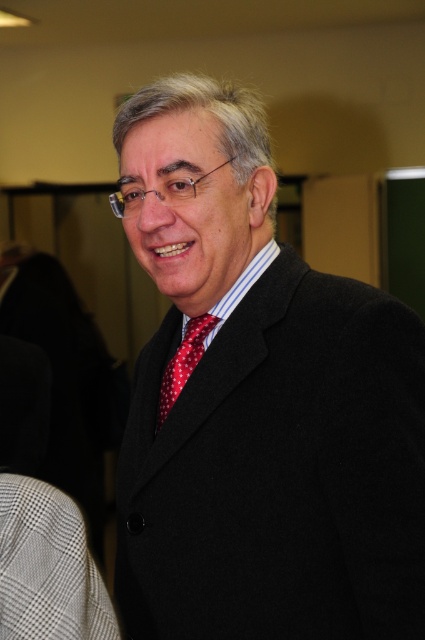
Question: Is matte black suit at center below red dotted tie at center?

Choices:
 (A) yes
 (B) no

Answer: (B)

Question: From the image, what is the correct spatial relationship of matte black suit at center in relation to red dotted tie at center?

Choices:
 (A) below
 (B) above

Answer: (B)

Question: Which object appears farthest from the camera in this image?

Choices:
 (A) matte black suit at center
 (B) red dotted tie at center

Answer: (B)

Question: Which point is farther to the camera?

Choices:
 (A) red dotted tie at center
 (B) matte black suit at center

Answer: (A)

Question: Among these objects, which one is nearest to the camera?

Choices:
 (A) red dotted tie at center
 (B) matte black suit at center

Answer: (B)

Question: Does matte black suit at center have a lesser width compared to red dotted tie at center?

Choices:
 (A) yes
 (B) no

Answer: (B)